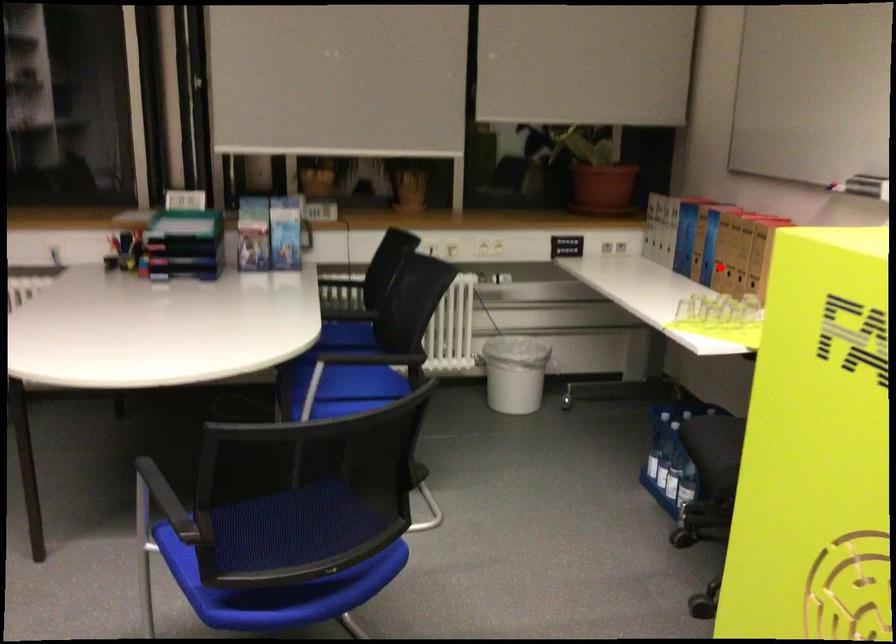
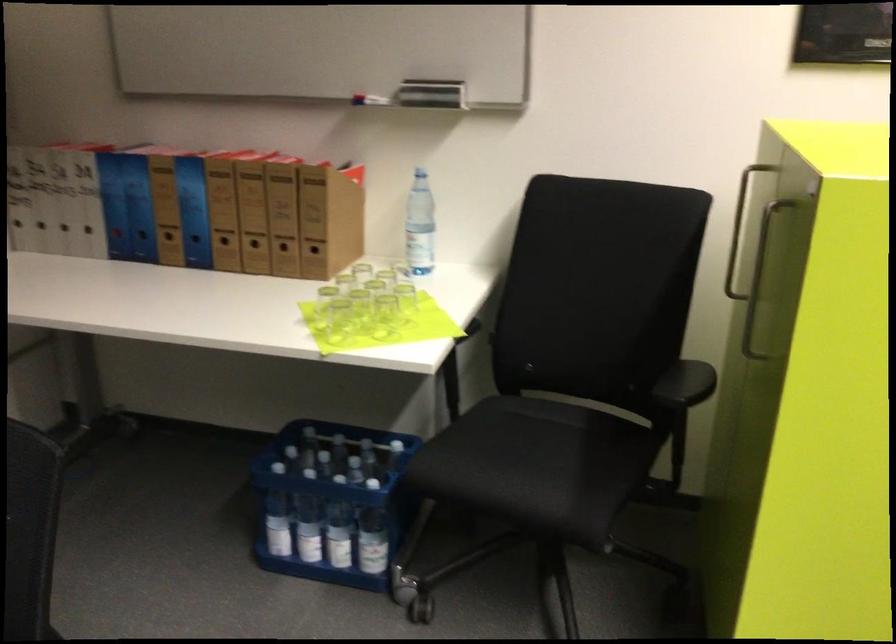
Locate, in the second image, the point that corresponds to the highlighted location in the first image.

(225, 245)